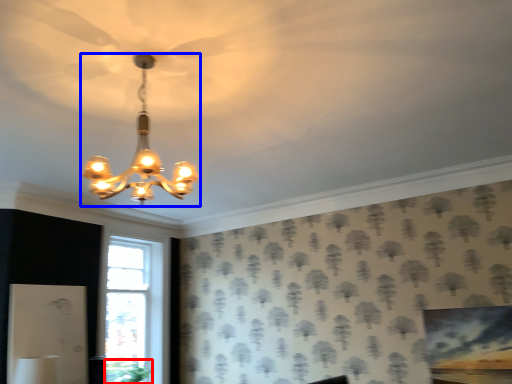
Question: Which point is further to the camera, plant (highlighted by a red box) or lamp (highlighted by a blue box)?

Choices:
 (A) plant
 (B) lamp

Answer: (A)